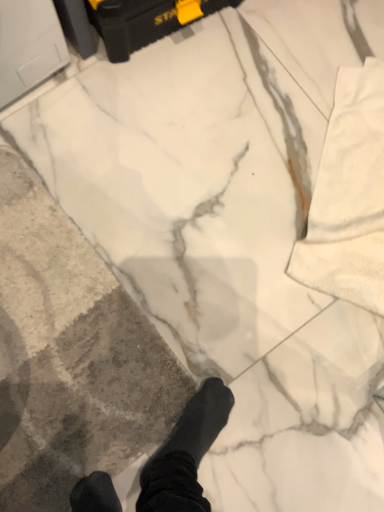
Identify the location of black plastic toolbox at upper center. (145, 21).

Describe the element at coordinates (145, 21) in the screenshot. I see `black plastic toolbox at upper center` at that location.

Image resolution: width=384 pixels, height=512 pixels. Describe the element at coordinates (70, 355) in the screenshot. I see `gray textured concrete at center` at that location.

In order to face gray textured concrete at center, should I rotate leftwards or rightwards?

You should look left and rotate roughly 21.728 degrees.

Where is `gray textured concrete at center`? The image size is (384, 512). gray textured concrete at center is located at coordinates (70, 355).

Image resolution: width=384 pixels, height=512 pixels. Identify the location of black plastic toolbox at upper center. (145, 21).

Considering the relative positions of black plastic toolbox at upper center and gray textured concrete at center in the image provided, is black plastic toolbox at upper center to the left of gray textured concrete at center from the viewer's perspective?

In fact, black plastic toolbox at upper center is to the right of gray textured concrete at center.

Does black plastic toolbox at upper center lie behind gray textured concrete at center?

That is True.

Does point (144, 2) appear closer or farther from the camera than point (120, 415)?

Point (144, 2).

From the image's perspective, which is below, black plastic toolbox at upper center or gray textured concrete at center?

gray textured concrete at center appears lower in the image.

From a real-world perspective, is black plastic toolbox at upper center on gray textured concrete at center?

Yes, from a real-world perspective, black plastic toolbox at upper center is over gray textured concrete at center

Does black plastic toolbox at upper center have a lesser width compared to gray textured concrete at center?

Indeed, black plastic toolbox at upper center has a lesser width compared to gray textured concrete at center.

Between black plastic toolbox at upper center and gray textured concrete at center, which one has less height?

Standing shorter between the two is gray textured concrete at center.

Can you confirm if black plastic toolbox at upper center is bigger than gray textured concrete at center?

Correct, black plastic toolbox at upper center is larger in size than gray textured concrete at center.

Would you say black plastic toolbox at upper center is inside or outside gray textured concrete at center?

black plastic toolbox at upper center cannot be found inside gray textured concrete at center.

Are black plastic toolbox at upper center and gray textured concrete at center beside each other?

No, black plastic toolbox at upper center is not touching gray textured concrete at center.

Is gray textured concrete at center at the back of black plastic toolbox at upper center?

No.

How many degrees apart are the facing directions of black plastic toolbox at upper center and gray textured concrete at center?

96.2 degrees separate the facing orientations of black plastic toolbox at upper center and gray textured concrete at center.

At what (x,y) coordinates should I click in order to perform the action: click on equipment above the gray textured concrete at center (from the image's perspective). Please return your answer as a coordinate pair (x, y). The width and height of the screenshot is (384, 512). Looking at the image, I should click on (145, 21).

In the image, is gray textured concrete at center on the left side or the right side of black plastic toolbox at upper center?

Based on their positions, gray textured concrete at center is located to the left of black plastic toolbox at upper center.

Considering the relative positions of gray textured concrete at center and black plastic toolbox at upper center in the image provided, is gray textured concrete at center in front of black plastic toolbox at upper center?

Yes, gray textured concrete at center is in front of black plastic toolbox at upper center.

Between point (26, 476) and point (143, 11), which one is positioned behind?

The point (143, 11) is behind.

From the image's perspective, between gray textured concrete at center and black plastic toolbox at upper center, who is located below?

From the image's view, gray textured concrete at center is below.

From a real-world perspective, who is located lower, gray textured concrete at center or black plastic toolbox at upper center?

gray textured concrete at center is physically lower.

Considering the sizes of objects gray textured concrete at center and black plastic toolbox at upper center in the image provided, who is wider, gray textured concrete at center or black plastic toolbox at upper center?

Wider between the two is gray textured concrete at center.

Can you confirm if gray textured concrete at center is taller than black plastic toolbox at upper center?

No, gray textured concrete at center is not taller than black plastic toolbox at upper center.

In terms of size, does gray textured concrete at center appear bigger or smaller than black plastic toolbox at upper center?

gray textured concrete at center is smaller than black plastic toolbox at upper center.

Is gray textured concrete at center located outside black plastic toolbox at upper center?

That's correct, gray textured concrete at center is outside of black plastic toolbox at upper center.

Are gray textured concrete at center and black plastic toolbox at upper center located far from each other?

That's not correct — gray textured concrete at center is a little close to black plastic toolbox at upper center.

Is black plastic toolbox at upper center at the back of gray textured concrete at center?

No, gray textured concrete at center's orientation is not away from black plastic toolbox at upper center.

At what (x,y) coordinates should I click in order to perform the action: click on concrete located in front of the black plastic toolbox at upper center. Please return your answer as a coordinate pair (x, y). Image resolution: width=384 pixels, height=512 pixels. Looking at the image, I should click on (70, 355).

Locate an element on the screen. equipment on the right of gray textured concrete at center is located at coordinates (145, 21).

You are a GUI agent. You are given a task and a screenshot of the screen. Output one action in this format:
    pyautogui.click(x=<x>, y=<y>)
    Task: Click on the equipment behind the gray textured concrete at center
    
    Given the screenshot: What is the action you would take?
    pyautogui.click(x=145, y=21)